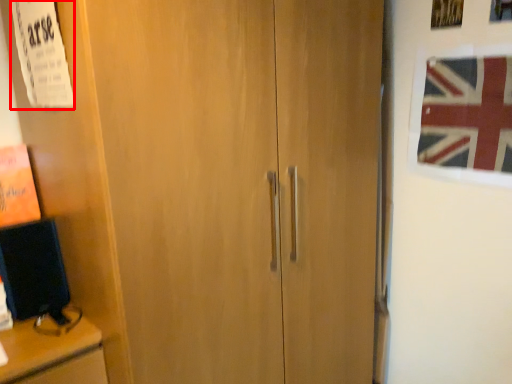
Question: Where is poster (annotated by the red box) located in relation to flag in the image?

Choices:
 (A) left
 (B) right

Answer: (A)